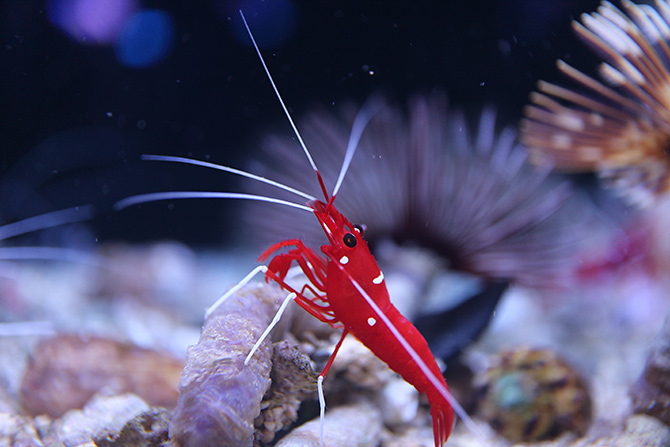
Locate an element on the screen. rostrum is located at coordinates (335, 229).